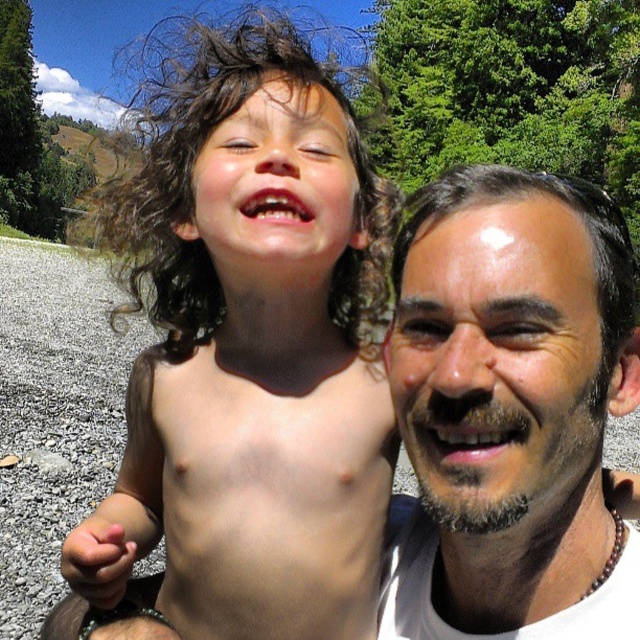
Question: Which object appears closest to the camera in this image?

Choices:
 (A) smooth skin face at upper right
 (B) skinsmoothtorso at center
 (C) brown curly hair at center
 (D) smooth skin face at right

Answer: (D)

Question: Estimate the real-world distances between objects in this image. Which object is closer to the brown curly hair at center?

Choices:
 (A) smooth skin face at right
 (B) skinsmoothtorso at center

Answer: (B)

Question: Is skinsmoothtorso at center above smooth skin face at upper right?

Choices:
 (A) yes
 (B) no

Answer: (B)

Question: Which of the following is the closest to the observer?

Choices:
 (A) (200, 604)
 (B) (198, 550)

Answer: (B)

Question: Does smooth skin face at right appear on the left side of skinsmoothtorso at center?

Choices:
 (A) yes
 (B) no

Answer: (B)

Question: Is brown curly hair at center positioned at the back of skinsmoothtorso at center?

Choices:
 (A) yes
 (B) no

Answer: (B)